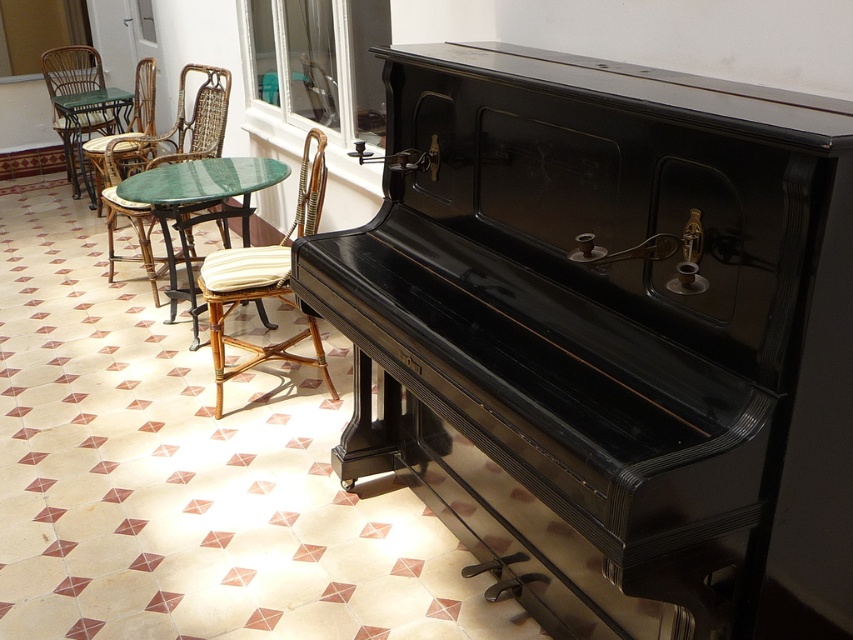
Is point (187, 182) closer to viewer compared to point (90, 65)?

Yes, point (187, 182) is closer to viewer.

Between green marble table at center and wicker chair at left, which one is positioned higher?

wicker chair at left is above.

Is point (141, 173) positioned in front of point (62, 136)?

Yes, point (141, 173) is in front of point (62, 136).

Find the location of a particular element. green marble table at center is located at coordinates (199, 205).

Between point (199, 216) and point (100, 196), which one is positioned behind?

Positioned behind is point (100, 196).

Does green marble table at center appear on the left side of woven rattan chair at left?

In fact, green marble table at center is to the right of woven rattan chair at left.

Who is more forward, (194, 292) or (129, 204)?

Point (194, 292) is in front.

Locate an element on the screen. This screenshot has height=640, width=853. green marble table at center is located at coordinates (199, 205).

Which is more to the left, woven rattan chair at left or wicker chair at left?

From the viewer's perspective, wicker chair at left appears more on the left side.

Is woven rattan chair at left above wicker chair at left?

No, woven rattan chair at left is not above wicker chair at left.

Who is more forward, (109, 269) or (102, 116)?

Positioned in front is point (109, 269).

The width and height of the screenshot is (853, 640). Identify the location of woven rattan chair at left. tap(164, 157).